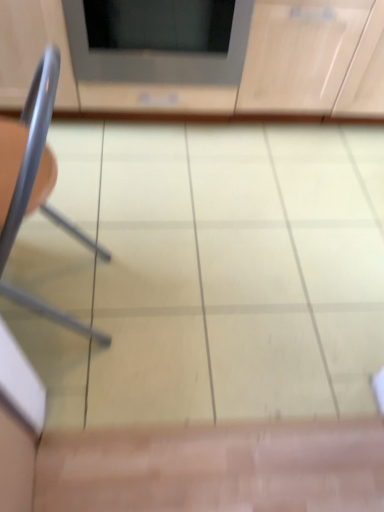
Question: Can you confirm if matte gray microwave at upper center is shorter than metallic gray chair at left?

Choices:
 (A) yes
 (B) no

Answer: (A)

Question: Is matte gray microwave at upper center positioned with its back to metallic gray chair at left?

Choices:
 (A) yes
 (B) no

Answer: (B)

Question: Does matte gray microwave at upper center have a smaller size compared to metallic gray chair at left?

Choices:
 (A) no
 (B) yes

Answer: (A)

Question: From the image's perspective, would you say matte gray microwave at upper center is positioned over metallic gray chair at left?

Choices:
 (A) no
 (B) yes

Answer: (B)

Question: Are matte gray microwave at upper center and metallic gray chair at left located far from each other?

Choices:
 (A) no
 (B) yes

Answer: (A)

Question: From a real-world perspective, is matte wood cabinet at upper center positioned above or below matte gray microwave at upper center?

Choices:
 (A) below
 (B) above

Answer: (A)

Question: Is matte wood cabinet at upper center inside or outside of matte gray microwave at upper center?

Choices:
 (A) inside
 (B) outside

Answer: (B)

Question: Considering their positions, is matte wood cabinet at upper center located in front of or behind matte gray microwave at upper center?

Choices:
 (A) front
 (B) behind

Answer: (A)

Question: Looking at their shapes, would you say matte wood cabinet at upper center is wider or thinner than matte gray microwave at upper center?

Choices:
 (A) wide
 (B) thin

Answer: (B)

Question: Does point (3, 242) appear closer or farther from the camera than point (6, 42)?

Choices:
 (A) farther
 (B) closer

Answer: (B)

Question: From a real-world perspective, is metallic gray chair at left physically located above or below matte wood cabinet at upper center?

Choices:
 (A) above
 (B) below

Answer: (A)

Question: Visually, is metallic gray chair at left positioned to the left or to the right of matte wood cabinet at upper center?

Choices:
 (A) left
 (B) right

Answer: (A)

Question: From the image's perspective, relative to matte wood cabinet at upper center, is metallic gray chair at left above or below?

Choices:
 (A) above
 (B) below

Answer: (B)

Question: Considering the positions of metallic gray chair at left and matte gray microwave at upper center in the image, is metallic gray chair at left wider or thinner than matte gray microwave at upper center?

Choices:
 (A) thin
 (B) wide

Answer: (A)

Question: From the image's perspective, relative to matte gray microwave at upper center, is metallic gray chair at left above or below?

Choices:
 (A) above
 (B) below

Answer: (B)